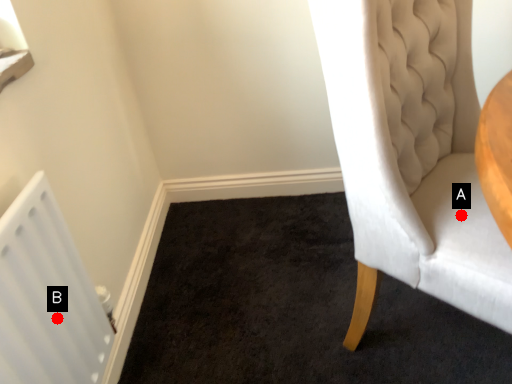
Question: Two points are circled on the image, labeled by A and B beside each circle. Among these points, which one is farthest from the camera?

Choices:
 (A) A is further
 (B) B is further

Answer: (A)